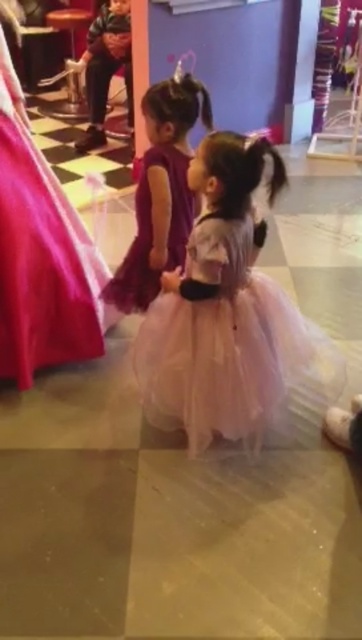
Can you confirm if pink tulle dress at center is thinner than purple tulle dress at left?

No.

Which of these two, pink tulle dress at center or purple tulle dress at left, stands taller?

purple tulle dress at left

Which is behind, point (229, 278) or point (111, 321)?

Positioned behind is point (111, 321).

I want to click on pink tulle dress at center, so 230,317.

Is point (6, 310) positioned in front of point (187, 81)?

No, (6, 310) is behind (187, 81).

Does purple tulle dress at left have a lesser width compared to purple tulle dress at center?

Yes, purple tulle dress at left is thinner than purple tulle dress at center.

Who is more forward, [0,35] or [169,184]?

Point [0,35] is in front.

The height and width of the screenshot is (640, 362). Identify the location of purple tulle dress at left. (40, 253).

In the scene shown: Who is shorter, pink tulle dress at center or purple tulle dress at center?

purple tulle dress at center is shorter.

Who is higher up, pink tulle dress at center or purple tulle dress at center?

purple tulle dress at center is higher up.

I want to click on pink tulle dress at center, so click(230, 317).

At what (x,y) coordinates should I click in order to perform the action: click on pink tulle dress at center. Please return your answer as a coordinate pair (x, y). The width and height of the screenshot is (362, 640). Looking at the image, I should click on (230, 317).